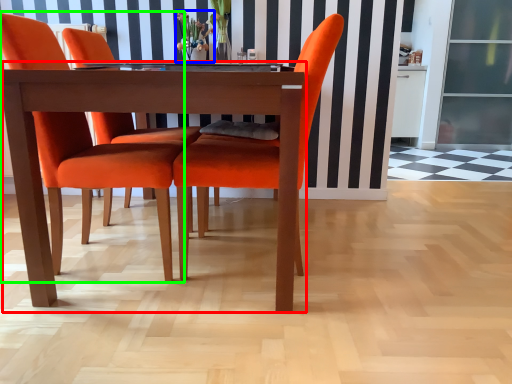
Question: Estimate the real-world distances between objects in this image. Which object is closer to kitchen & dining room table (highlighted by a red box), floral arrangement (highlighted by a blue box) or chair (highlighted by a green box)?

Choices:
 (A) floral arrangement
 (B) chair

Answer: (B)